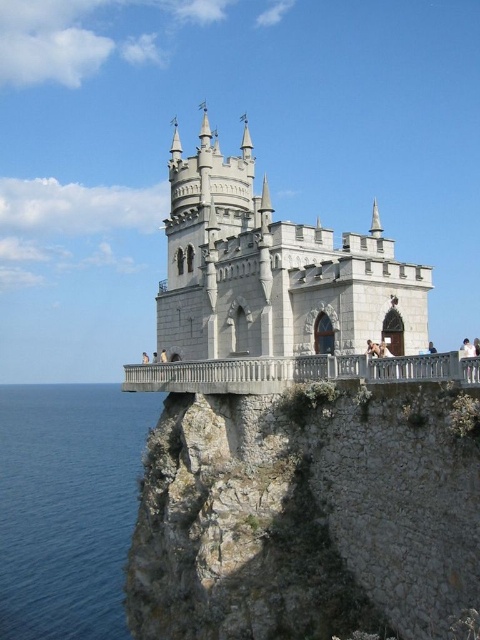
Which of these two, white stone castle at center or blue water at lower left, stands shorter?

With less height is blue water at lower left.

Is point (323, 339) more distant than point (17, 589)?

No.

Find the location of a particular element. The image size is (480, 640). white stone castle at center is located at coordinates (266, 282).

Does gray rocky cliff at center have a greater height compared to blue water at lower left?

Correct, gray rocky cliff at center is much taller as blue water at lower left.

Which is above, gray rocky cliff at center or blue water at lower left?

gray rocky cliff at center is higher up.

Describe the element at coordinates (308, 515) in the screenshot. This screenshot has width=480, height=640. I see `gray rocky cliff at center` at that location.

This screenshot has width=480, height=640. In order to click on gray rocky cliff at center in this screenshot , I will do `click(308, 515)`.

Is gray rocky cliff at center thinner than white stone castle at center?

Yes, gray rocky cliff at center is thinner than white stone castle at center.

Is gray rocky cliff at center to the right of white stone castle at center from the viewer's perspective?

In fact, gray rocky cliff at center is to the left of white stone castle at center.

The width and height of the screenshot is (480, 640). Identify the location of gray rocky cliff at center. (308, 515).

The width and height of the screenshot is (480, 640). What are the coordinates of `gray rocky cliff at center` in the screenshot? It's located at (308, 515).